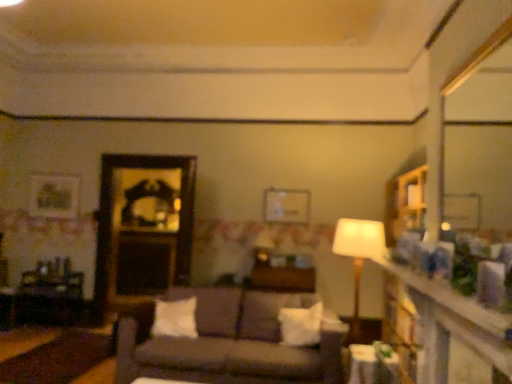
What is the approximate height of white soft pillow at center, which ranks as the 2th pillow in right-to-left order?

white soft pillow at center, which ranks as the 2th pillow in right-to-left order, is 13.78 inches in height.

At what (x,y) coordinates should I click in order to perform the action: click on metallic silver picture frame at center. Please return your answer as a coordinate pair (x, y). Looking at the image, I should click on (286, 205).

What do you see at coordinates (49, 299) in the screenshot? I see `wooden table at left, placed as the first table when sorted from left to right` at bounding box center [49, 299].

Looking at this image, how much space does wooden table at center, arranged as the second table when viewed from the back, occupy horizontally?

wooden table at center, arranged as the second table when viewed from the back, is 20.32 inches in width.

What do you see at coordinates (282, 278) in the screenshot? I see `wooden table at center, which appears as the second table when viewed from the left` at bounding box center [282, 278].

The image size is (512, 384). Identify the location of wooden mirror at center, acting as the first mirror starting from the back. (151, 206).

Could smooth wooden mirror at upper right, which is counted as the second mirror, starting from the left, be considered to be inside wooden mirror at center, which is the second mirror in right-to-left order?

No, smooth wooden mirror at upper right, which is counted as the second mirror, starting from the left, is located outside of wooden mirror at center, which is the second mirror in right-to-left order.

From a real-world perspective, who is located higher, wooden mirror at center, which is the second mirror in right-to-left order, or smooth wooden mirror at upper right, which is counted as the second mirror, starting from the left?

smooth wooden mirror at upper right, which is counted as the second mirror, starting from the left, is physically above.

Which is closer, (131, 228) or (459, 204)?

Point (131, 228) is positioned farther from the camera compared to point (459, 204).

Is the surface of wooden mirror at center, the second mirror positioned from the front, in direct contact with smooth wooden mirror at upper right, positioned as the 1th mirror in right-to-left order?

There is a gap between wooden mirror at center, the second mirror positioned from the front, and smooth wooden mirror at upper right, positioned as the 1th mirror in right-to-left order.

Based on the photo, could you measure the distance between wooden table at center, arranged as the second table when viewed from the back, and white fabric lampshade at center?

wooden table at center, arranged as the second table when viewed from the back, is 5.91 feet away from white fabric lampshade at center.

From a real-world perspective, which is physically below, wooden table at center, which appears as the second table when viewed from the left, or white fabric lampshade at center?

wooden table at center, which appears as the second table when viewed from the left.

Is wooden table at center, arranged as the second table when viewed from the back, not inside white fabric lampshade at center?

Yes, wooden table at center, arranged as the second table when viewed from the back, is not within white fabric lampshade at center.

Is white soft pillow at center, placed as the 1th pillow when sorted from left to right, turned away from metallic silver picture frame at center?

No, white soft pillow at center, placed as the 1th pillow when sorted from left to right,'s orientation is not away from metallic silver picture frame at center.

What's the angular difference between white soft pillow at center, which ranks as the 2th pillow in right-to-left order, and metallic silver picture frame at center's facing directions?

2.24 degrees separate the facing orientations of white soft pillow at center, which ranks as the 2th pillow in right-to-left order, and metallic silver picture frame at center.

Is white soft pillow at center, which ranks as the 2th pillow in right-to-left order, positioned far away from metallic silver picture frame at center?

Indeed, white soft pillow at center, which ranks as the 2th pillow in right-to-left order, is not near metallic silver picture frame at center.

Considering the positions of points (179, 327) and (284, 209), is point (179, 327) closer to camera compared to point (284, 209)?

Yes.

From a real-world perspective, between dark brown fabric couch at center and wooden table at center, arranged as the second table when viewed from the front, who is vertically lower?

dark brown fabric couch at center.

From the image's perspective, is dark brown fabric couch at center on top of wooden table at center, arranged as the second table when viewed from the back?

No, from the image's perspective, dark brown fabric couch at center is not above wooden table at center, arranged as the second table when viewed from the back.

Would you say dark brown fabric couch at center is outside wooden table at center, which appears as the second table when viewed from the left?

Yes, dark brown fabric couch at center is located beyond the bounds of wooden table at center, which appears as the second table when viewed from the left.

Is white fabric lampshade at center next to white soft pillow at center, placed as the 1th pillow when sorted from left to right?

white fabric lampshade at center is not next to white soft pillow at center, placed as the 1th pillow when sorted from left to right, and they're not touching.

Is white soft pillow at center, which ranks as the 2th pillow in right-to-left order, a part of white fabric lampshade at center?

Definitely not — white soft pillow at center, which ranks as the 2th pillow in right-to-left order, is not inside white fabric lampshade at center.

From a real-world perspective, is white fabric lampshade at center positioned over white soft pillow at center, which ranks as the 2th pillow in right-to-left order, based on gravity?

Yes, from a real-world perspective, white fabric lampshade at center is above white soft pillow at center, which ranks as the 2th pillow in right-to-left order.

This screenshot has height=384, width=512. Identify the location of table lamp in front of the white soft pillow at center, placed as the 1th pillow when sorted from left to right. 358,255.

How different are the orientations of dark brown fabric couch at center and wooden mirror at center, positioned as the first mirror in left-to-right order, in degrees?

The facing directions of dark brown fabric couch at center and wooden mirror at center, positioned as the first mirror in left-to-right order, are 0.606 degrees apart.

Is dark brown fabric couch at center smaller than wooden mirror at center, positioned as the first mirror in left-to-right order?

No.

This screenshot has width=512, height=384. What are the coordinates of `mirror that is on the left side of dark brown fabric couch at center` in the screenshot? It's located at (151, 206).

Which of these two, wooden mirror at center, the second mirror positioned from the front, or wooden dresser at right, is bigger?

With larger size is wooden mirror at center, the second mirror positioned from the front.

In the scene shown: Which of these two, wooden mirror at center, which is the second mirror in right-to-left order, or wooden dresser at right, is wider?

wooden dresser at right is wider.

Based on the photo, is wooden dresser at right a part of wooden mirror at center, acting as the first mirror starting from the back?

No.

Identify the location of dresser that appears in front of the wooden mirror at center, the second mirror positioned from the front. (451, 324).

Find the location of a particular element. This screenshot has height=384, width=512. mirror behind the smooth wooden mirror at upper right, positioned as the 1th mirror in right-to-left order is located at coordinates (151, 206).

Find the location of a particular element. table lamp above the wooden table at center, arranged as the 2th table when viewed from the right (from the image's perspective) is located at coordinates (358, 255).

Estimate the real-world distances between objects in this image. Which object is further from white glossy table at lower right, placed as the 1th table when sorted from front to back, wooden mirror at center, acting as the first mirror starting from the back, or wooden table at center, arranged as the second table when viewed from the back?

wooden mirror at center, acting as the first mirror starting from the back.

Looking at the image, which one is located closer to white soft pillow at center, which ranks as the 2th pillow in right-to-left order, wooden table at left, the 3th table when ordered from right to left, or white glossy table at lower right, acting as the third table starting from the left?

white glossy table at lower right, acting as the third table starting from the left.

Considering their positions, is white soft pillow at center, which ranks as the 2th pillow in right-to-left order, positioned closer to dark brown fabric couch at center than metallic silver picture frame at center?

white soft pillow at center, which ranks as the 2th pillow in right-to-left order, lies closer to dark brown fabric couch at center than the other object.

From the image, which object appears to be nearer to smooth wooden mirror at upper right, arranged as the 1th mirror when viewed from the front, white fabric lampshade at center or wooden table at center, arranged as the 2th table when viewed from the right?

white fabric lampshade at center lies closer to smooth wooden mirror at upper right, arranged as the 1th mirror when viewed from the front, than the other object.

From the image, which object appears to be farther from white soft pillow at center, which ranks as the 2th pillow in right-to-left order, dark brown fabric couch at center or white soft pillow at center, arranged as the 2th pillow when viewed from the left?

white soft pillow at center, arranged as the 2th pillow when viewed from the left, is positioned further to the anchor white soft pillow at center, which ranks as the 2th pillow in right-to-left order.

Based on their spatial positions, is wooden mirror at center, which is the second mirror in right-to-left order, or smooth wooden mirror at upper right, arranged as the 1th mirror when viewed from the front, closer to dark brown fabric couch at center?

The object closer to dark brown fabric couch at center is wooden mirror at center, which is the second mirror in right-to-left order.

From the picture: Looking at the image, which one is located closer to smooth wooden mirror at upper right, positioned as the 1th mirror in right-to-left order, wooden table at center, which appears as the second table when viewed from the left, or white glossy table at lower right, which is the 1th table from right to left?

wooden table at center, which appears as the second table when viewed from the left, is positioned closer to the anchor smooth wooden mirror at upper right, positioned as the 1th mirror in right-to-left order.

Considering their positions, is smooth wooden mirror at upper right, arranged as the 1th mirror when viewed from the front, positioned closer to white glossy table at lower right, which appears as the third table when viewed from the back, than white soft pillow at center, which is counted as the first pillow, starting from the right?

white soft pillow at center, which is counted as the first pillow, starting from the right, lies closer to white glossy table at lower right, which appears as the third table when viewed from the back, than the other object.

At what (x,y) coordinates should I click in order to perform the action: click on studio couch located between wooden dresser at right and wooden table at center, arranged as the 2th table when viewed from the right, in the depth direction. Please return your answer as a coordinate pair (x, y). Looking at the image, I should click on (232, 343).

The width and height of the screenshot is (512, 384). What are the coordinates of `pillow between wooden table at left, placed as the first table when sorted from left to right, and wooden table at center, arranged as the second table when viewed from the front` in the screenshot? It's located at (175, 318).

You are a GUI agent. You are given a task and a screenshot of the screen. Output one action in this format:
    pyautogui.click(x=<x>, y=<y>)
    Task: Click on the table situated between wooden table at left, the 3th table when ordered from right to left, and white soft pillow at center, which is counted as the first pillow, starting from the right, from left to right
    
    Given the screenshot: What is the action you would take?
    pyautogui.click(x=282, y=278)

Where is `mirror located between wooden dresser at right and white glossy table at lower right, acting as the third table starting from the left, in the depth direction`? The width and height of the screenshot is (512, 384). mirror located between wooden dresser at right and white glossy table at lower right, acting as the third table starting from the left, in the depth direction is located at coordinates (480, 137).